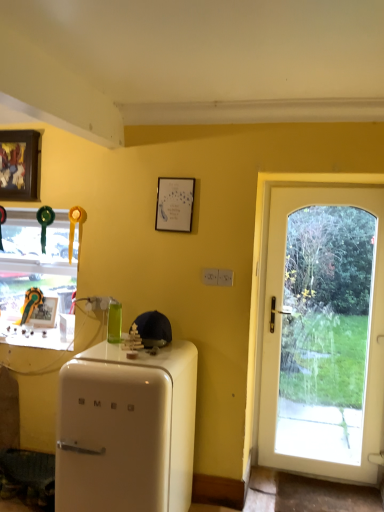
Question: Is green glass bottle at center closer to camera compared to white matte picture frame at upper center, the 2th picture frame in the top-to-bottom sequence?

Choices:
 (A) yes
 (B) no

Answer: (A)

Question: From a real-world perspective, is green glass bottle at center over white matte picture frame at upper center, acting as the third picture frame starting from the left?

Choices:
 (A) yes
 (B) no

Answer: (B)

Question: From the image's perspective, is green glass bottle at center below white matte picture frame at upper center, the 2th picture frame in the top-to-bottom sequence?

Choices:
 (A) yes
 (B) no

Answer: (A)

Question: Considering the relative positions of green glass bottle at center and white matte picture frame at upper center, which is counted as the 1th picture frame, starting from the right, in the image provided, is green glass bottle at center to the right of white matte picture frame at upper center, which is counted as the 1th picture frame, starting from the right, from the viewer's perspective?

Choices:
 (A) yes
 (B) no

Answer: (B)

Question: Is green glass bottle at center aimed at white matte picture frame at upper center, which is counted as the third picture frame, starting from the back?

Choices:
 (A) no
 (B) yes

Answer: (A)

Question: From the image's perspective, is white glossy refrigerator at lower left positioned above or below clear glass window at left?

Choices:
 (A) above
 (B) below

Answer: (B)

Question: From a real-world perspective, relative to clear glass window at left, is white glossy refrigerator at lower left vertically above or below?

Choices:
 (A) above
 (B) below

Answer: (B)

Question: Considering the positions of white glossy refrigerator at lower left and clear glass window at left in the image, is white glossy refrigerator at lower left wider or thinner than clear glass window at left?

Choices:
 (A) wide
 (B) thin

Answer: (A)

Question: Based on their positions, is white glossy refrigerator at lower left located to the left or right of clear glass window at left?

Choices:
 (A) right
 (B) left

Answer: (A)

Question: Is white glass door at right taller or shorter than white glossy refrigerator at lower left?

Choices:
 (A) short
 (B) tall

Answer: (B)

Question: From a real-world perspective, is white glass door at right positioned above or below white glossy refrigerator at lower left?

Choices:
 (A) above
 (B) below

Answer: (A)

Question: From the image's perspective, relative to white glossy refrigerator at lower left, is white glass door at right above or below?

Choices:
 (A) below
 (B) above

Answer: (B)

Question: In the image, is white glass door at right positioned in front of or behind white glossy refrigerator at lower left?

Choices:
 (A) front
 (B) behind

Answer: (B)

Question: Is green glass bottle at center spatially inside white glossy refrigerator at lower left, or outside of it?

Choices:
 (A) inside
 (B) outside

Answer: (B)

Question: Does point (112, 320) appear closer or farther from the camera than point (84, 429)?

Choices:
 (A) closer
 (B) farther

Answer: (B)